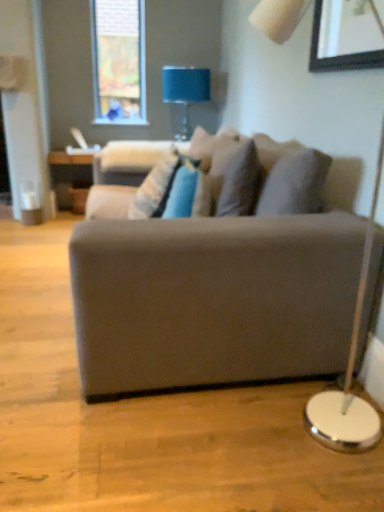
Question: Considering the relative sizes of velvet beige swivel chair at center and textured beige pillow at center in the image provided, is velvet beige swivel chair at center taller than textured beige pillow at center?

Choices:
 (A) no
 (B) yes

Answer: (A)

Question: Can you confirm if velvet beige swivel chair at center is positioned to the right of textured beige pillow at center?

Choices:
 (A) no
 (B) yes

Answer: (A)

Question: Would you say velvet beige swivel chair at center is outside textured beige pillow at center?

Choices:
 (A) no
 (B) yes

Answer: (B)

Question: From the image's perspective, is velvet beige swivel chair at center over textured beige pillow at center?

Choices:
 (A) no
 (B) yes

Answer: (B)

Question: Is velvet beige swivel chair at center to the left of textured beige pillow at center from the viewer's perspective?

Choices:
 (A) no
 (B) yes

Answer: (B)

Question: In the image, is wooden picture frame at upper right on the left side or the right side of blue fabric lampshade at upper center?

Choices:
 (A) right
 (B) left

Answer: (A)

Question: Does point (316, 54) appear closer or farther from the camera than point (177, 77)?

Choices:
 (A) farther
 (B) closer

Answer: (B)

Question: Is wooden picture frame at upper right spatially inside blue fabric lampshade at upper center, or outside of it?

Choices:
 (A) inside
 (B) outside

Answer: (B)

Question: Is wooden picture frame at upper right wider or thinner than blue fabric lampshade at upper center?

Choices:
 (A) wide
 (B) thin

Answer: (B)

Question: Relative to suede gray couch at center, is velvet beige swivel chair at center in front or behind?

Choices:
 (A) front
 (B) behind

Answer: (B)

Question: From the image's perspective, is velvet beige swivel chair at center positioned above or below suede gray couch at center?

Choices:
 (A) above
 (B) below

Answer: (A)

Question: From their relative heights in the image, would you say velvet beige swivel chair at center is taller or shorter than suede gray couch at center?

Choices:
 (A) tall
 (B) short

Answer: (B)

Question: Would you say velvet beige swivel chair at center is inside or outside suede gray couch at center?

Choices:
 (A) inside
 (B) outside

Answer: (A)

Question: Considering the positions of textured beige pillow at center and suede gray couch at center in the image, is textured beige pillow at center bigger or smaller than suede gray couch at center?

Choices:
 (A) big
 (B) small

Answer: (B)

Question: Based on their positions, is textured beige pillow at center located to the left or right of suede gray couch at center?

Choices:
 (A) left
 (B) right

Answer: (A)